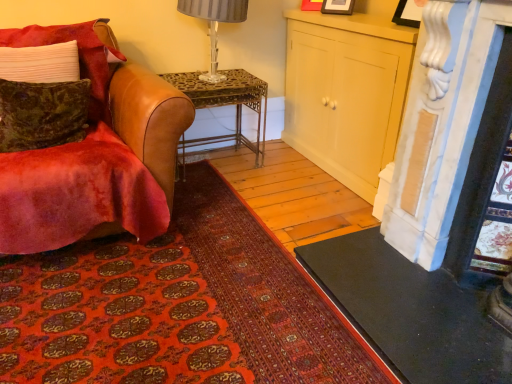
Locate an element on the screen. The height and width of the screenshot is (384, 512). metallic wrought iron desk at center is located at coordinates (224, 105).

The image size is (512, 384). Describe the element at coordinates (42, 114) in the screenshot. I see `velvet green pillow at left, which ranks as the 1th pillow in bottom-to-top order` at that location.

Where is `metallic silver lamp at upper center`? metallic silver lamp at upper center is located at coordinates (214, 24).

The image size is (512, 384). Describe the element at coordinates (346, 93) in the screenshot. I see `matte cream cabinet at center` at that location.

The height and width of the screenshot is (384, 512). Find the location of `white marble fireplace at right`. white marble fireplace at right is located at coordinates (425, 221).

From the image's perspective, which one is positioned lower, matte cream cabinet at center or metallic wrought iron desk at center?

From the image's view, metallic wrought iron desk at center is below.

Based on the photo, does matte cream cabinet at center have a lesser width compared to metallic wrought iron desk at center?

Yes.

Is point (345, 16) less distant than point (173, 80)?

Yes, point (345, 16) is in front of point (173, 80).

Is metallic wrought iron desk at center oriented towards velvet brown leather chair at left?

No, metallic wrought iron desk at center is not facing towards velvet brown leather chair at left.

Looking at this image, is metallic wrought iron desk at center to the left of velvet brown leather chair at left from the viewer's perspective?

Incorrect, metallic wrought iron desk at center is not on the left side of velvet brown leather chair at left.

Find the location of a particular element. The height and width of the screenshot is (384, 512). desk located on the right of velvet brown leather chair at left is located at coordinates (224, 105).

From the image's perspective, which one is positioned lower, metallic wrought iron desk at center or velvet brown leather chair at left?

From the image's view, velvet brown leather chair at left is below.

Does point (356, 30) lie behind point (217, 61)?

No, it is in front of (217, 61).

From the picture: Choose the correct answer: Is matte cream cabinet at center inside metallic silver lamp at upper center or outside it?

matte cream cabinet at center exists outside the volume of metallic silver lamp at upper center.

Considering the relative sizes of matte cream cabinet at center and metallic silver lamp at upper center in the image provided, is matte cream cabinet at center smaller than metallic silver lamp at upper center?

No.

Could you tell me if white marble fireplace at right is facing metallic wrought iron desk at center?

No, white marble fireplace at right is not aimed at metallic wrought iron desk at center.

From their relative heights in the image, would you say white marble fireplace at right is taller or shorter than metallic wrought iron desk at center?

In the image, white marble fireplace at right appears to be taller than metallic wrought iron desk at center.

Which object is wider, white marble fireplace at right or metallic wrought iron desk at center?

Wider between the two is metallic wrought iron desk at center.

From the image's perspective, is velvet green pillow at left, which ranks as the 1th pillow in bottom-to-top order, on top of velvet brown leather chair at left?

Indeed, from the image's perspective, velvet green pillow at left, which ranks as the 1th pillow in bottom-to-top order, is shown above velvet brown leather chair at left.

Is point (79, 136) farther from viewer compared to point (167, 188)?

No, (79, 136) is in front of (167, 188).

Is velvet green pillow at left, which ranks as the 1th pillow in bottom-to-top order, oriented towards velvet brown leather chair at left?

Yes, velvet green pillow at left, which ranks as the 1th pillow in bottom-to-top order, is oriented towards velvet brown leather chair at left.

Is velvet green pillow at left, which ranks as the 1th pillow in bottom-to-top order, positioned far away from velvet brown leather chair at left?

No, velvet green pillow at left, which ranks as the 1th pillow in bottom-to-top order, is not far from velvet brown leather chair at left.

Which object is positioned more to the right, velvet green pillow at left, which is the second pillow from bottom to top, or velvet brown leather chair at left?

velvet brown leather chair at left is more to the right.

Would you say velvet green pillow at left, arranged as the first pillow when viewed from the top, is outside velvet brown leather chair at left?

No, velvet green pillow at left, arranged as the first pillow when viewed from the top, is inside or overlapping with velvet brown leather chair at left.

Considering the points (80, 30) and (96, 208), which point is behind, point (80, 30) or point (96, 208)?

The point (80, 30) is more distant.

From the image's perspective, does velvet green pillow at left, which is the second pillow from bottom to top, appear higher than velvet brown leather chair at left?

Yes.

In order to click on desk that appears on the left of matte cream cabinet at center in this screenshot , I will do `click(224, 105)`.

Which is less distant, (191,93) or (346,31)?

Point (191,93) is farther from the camera than point (346,31).

Is metallic wrought iron desk at center wider than matte cream cabinet at center?

Yes.

From the image's perspective, is metallic wrought iron desk at center above or below matte cream cabinet at center?

metallic wrought iron desk at center is situated lower than matte cream cabinet at center in the image.

Where is `desk that is below the matte cream cabinet at center (from the image's perspective)`? The image size is (512, 384). desk that is below the matte cream cabinet at center (from the image's perspective) is located at coordinates (224, 105).

This screenshot has width=512, height=384. I want to click on chair above the metallic wrought iron desk at center (from a real-world perspective), so click(96, 155).

When comparing their distances from velvet brown leather chair at left, does metallic silver lamp at upper center or white marble fireplace at right seem further?

Among the two, white marble fireplace at right is located further to velvet brown leather chair at left.

From the image, which object appears to be farther from metallic wrought iron desk at center, metallic silver lamp at upper center or white marble fireplace at right?

white marble fireplace at right is positioned further to the anchor metallic wrought iron desk at center.

From the image, which object appears to be farther from velvet brown leather chair at left, white marble fireplace at right or metallic silver lamp at upper center?

white marble fireplace at right lies further to velvet brown leather chair at left than the other object.

Looking at the image, which one is located closer to velvet brown leather chair at left, metallic silver lamp at upper center or velvet green pillow at left, arranged as the first pillow when viewed from the top?

A: velvet green pillow at left, arranged as the first pillow when viewed from the top, lies closer to velvet brown leather chair at left than the other object.

Consider the image. When comparing their distances from matte cream cabinet at center, does velvet green pillow at left, which ranks as the 2th pillow in top-to-bottom order, or metallic silver lamp at upper center seem closer?

metallic silver lamp at upper center is closer to matte cream cabinet at center.

From the image, which object appears to be farther from white marble fireplace at right, metallic wrought iron desk at center or metallic silver lamp at upper center?

metallic silver lamp at upper center.

Based on their spatial positions, is metallic silver lamp at upper center or metallic wrought iron desk at center further from white marble fireplace at right?

metallic silver lamp at upper center.

From the image, which object appears to be farther from velvet green pillow at left, arranged as the first pillow when viewed from the top, velvet brown leather chair at left or white marble fireplace at right?

white marble fireplace at right lies further to velvet green pillow at left, arranged as the first pillow when viewed from the top, than the other object.

Image resolution: width=512 pixels, height=384 pixels. I want to click on cabinetry between velvet green pillow at left, which is the second pillow from bottom to top, and white marble fireplace at right, so click(x=346, y=93).

Locate an element on the screen. The width and height of the screenshot is (512, 384). cabinetry located between velvet brown leather chair at left and white marble fireplace at right in the left-right direction is located at coordinates (346, 93).

Identify the location of lamp between metallic wrought iron desk at center and matte cream cabinet at center in the horizontal direction. The width and height of the screenshot is (512, 384). (214, 24).

The image size is (512, 384). I want to click on lamp between velvet brown leather chair at left and white marble fireplace at right, so click(214, 24).